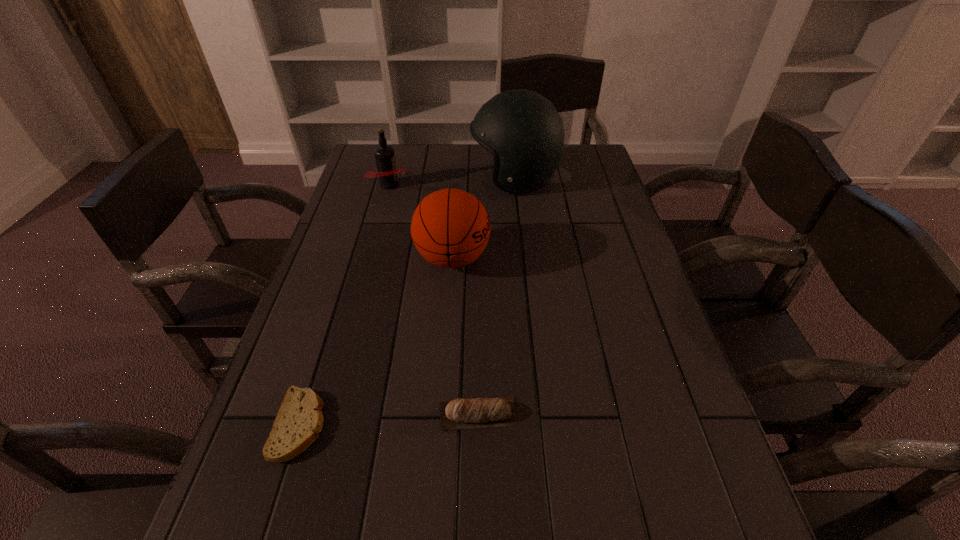
Identify the location of object positioned at the far right corner. The width and height of the screenshot is (960, 540). (522, 129).

The image size is (960, 540). In order to click on vacant area at the far edge of the desktop in this screenshot , I will do `click(457, 171)`.

At what (x,y) coordinates should I click in order to perform the action: click on vacant space at the left edge of the desktop. Please return your answer as a coordinate pair (x, y). The height and width of the screenshot is (540, 960). Looking at the image, I should click on (277, 407).

I want to click on free spot at the right edge of the desktop, so click(x=639, y=288).

At what (x,y) coordinates should I click in order to perform the action: click on free location at the far left corner. Please return your answer as a coordinate pair (x, y). Looking at the image, I should click on click(x=363, y=166).

Where is `free area in between the tallest object and the fourth tallest object`? This screenshot has height=540, width=960. free area in between the tallest object and the fourth tallest object is located at coordinates tap(496, 296).

The height and width of the screenshot is (540, 960). Find the location of `empty space that is in between the taller pita bread and the root beer`. empty space that is in between the taller pita bread and the root beer is located at coordinates (434, 299).

Where is `free space between the shortest object and the right pita bread`? This screenshot has height=540, width=960. free space between the shortest object and the right pita bread is located at coordinates (389, 419).

You are a GUI agent. You are given a task and a screenshot of the screen. Output one action in this format:
    pyautogui.click(x=<x>, y=<y>)
    Task: Click on the free space between the root beer and the tallest object
    Image resolution: width=960 pixels, height=540 pixels.
    Given the screenshot: What is the action you would take?
    pyautogui.click(x=452, y=181)

This screenshot has width=960, height=540. In order to click on vacant area that lies between the football helmet and the left pita bread in this screenshot , I will do `click(407, 301)`.